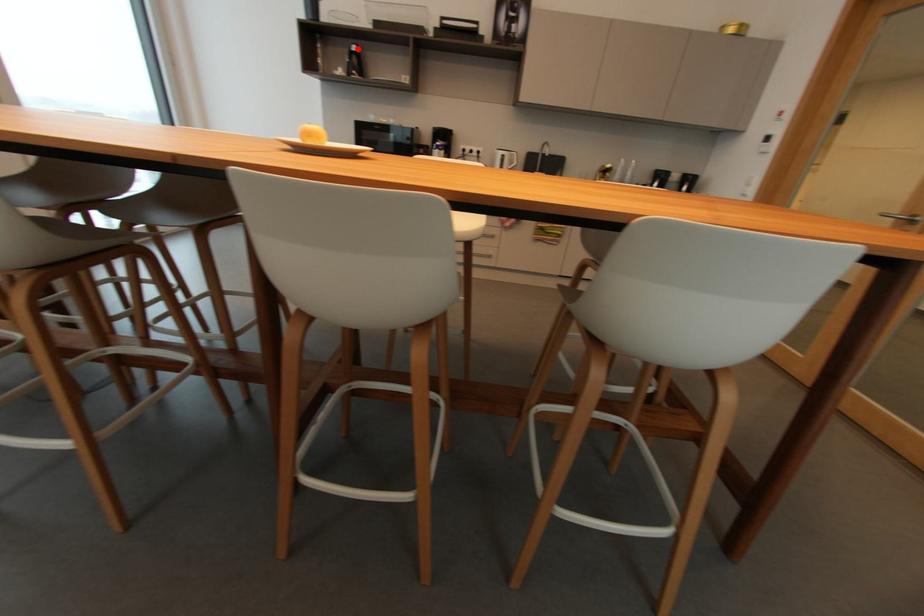
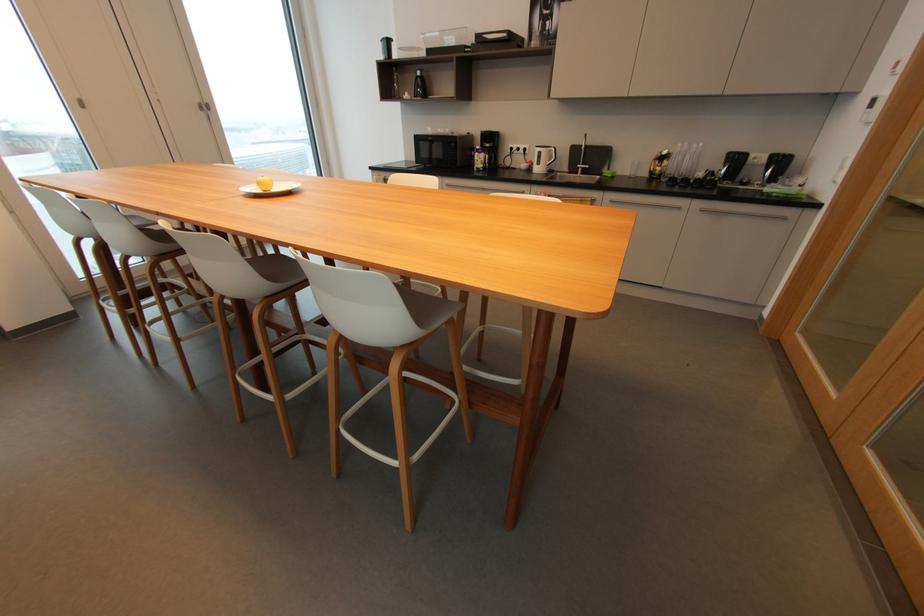
In the second image, find the point that corresponds to the highlighted location in the first image.

(421, 74)